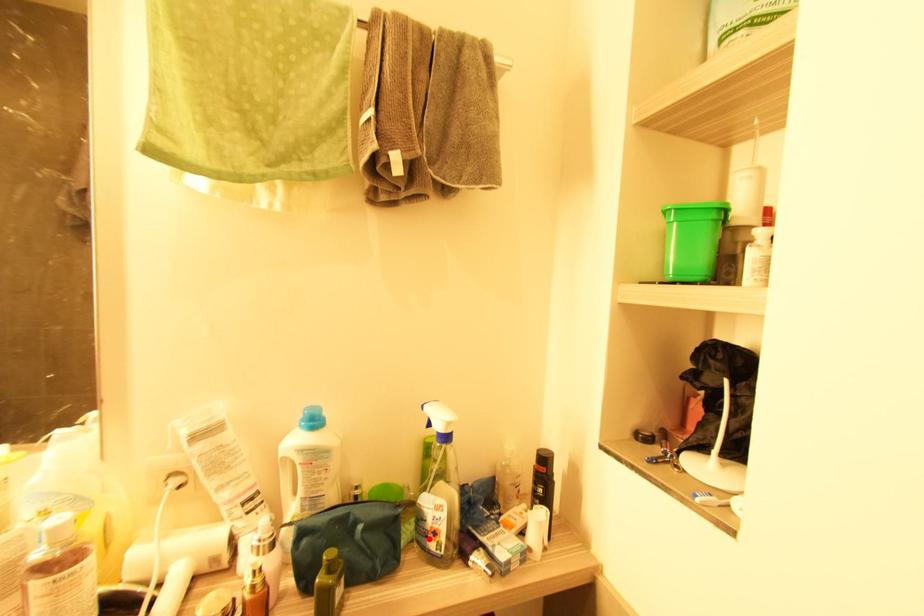
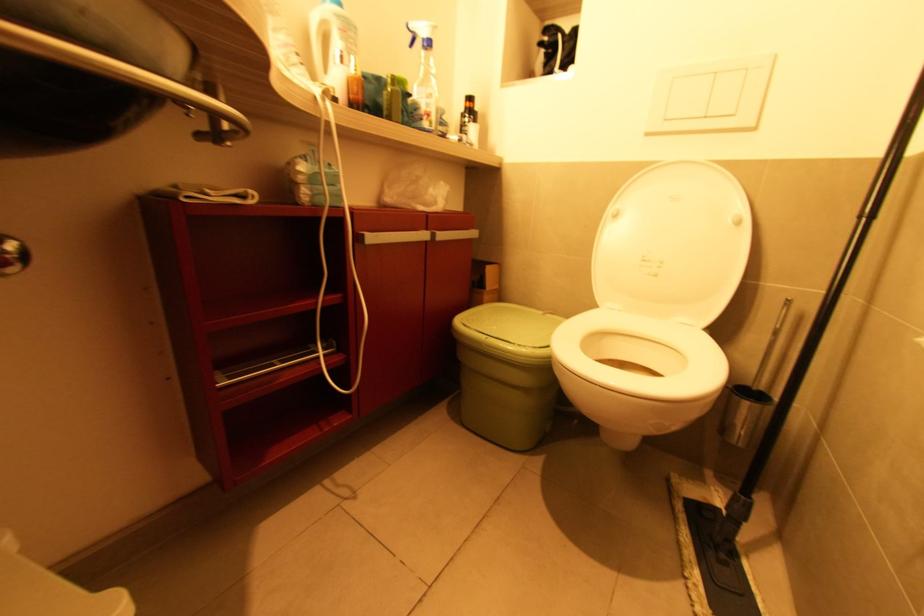
Question: I am providing you with two images of the same scene from different viewpoints. Image1 has a red point marked. In image2, the corresponding 3D location appears at what relative position? Reply with the corresponding letter.

Choices:
 (A) Closer
 (B) Farther

Answer: (A)